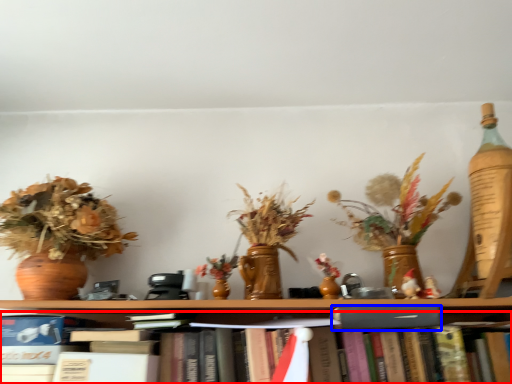
Question: Which of the following is the farthest to the observer, book (highlighted by a red box) or paperback book (highlighted by a blue box)?

Choices:
 (A) book
 (B) paperback book

Answer: (B)